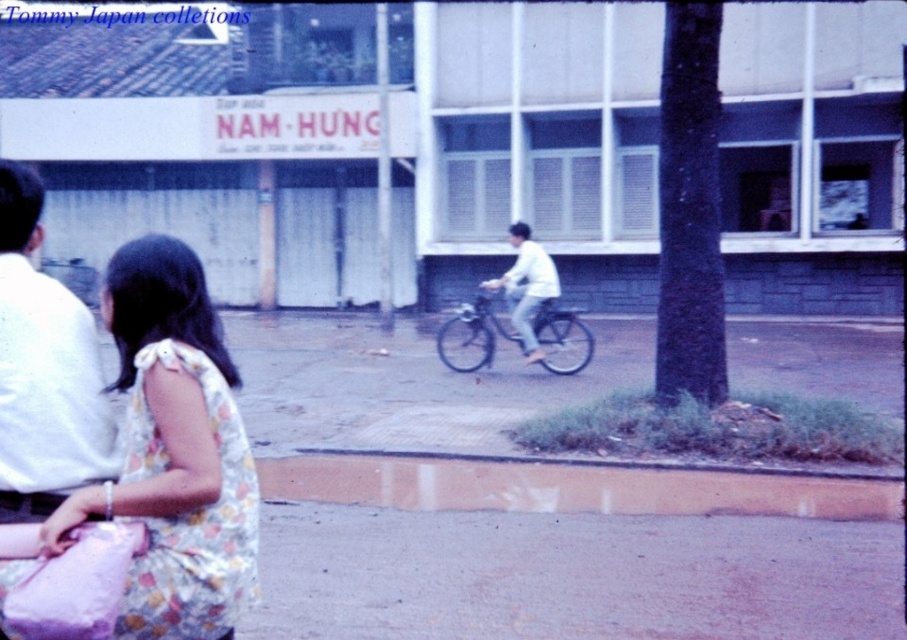
Who is higher up, floral fabric dress at lower left or white matte bicycle at center?

Positioned higher is white matte bicycle at center.

Can you confirm if floral fabric dress at lower left is positioned to the right of white matte bicycle at center?

No, floral fabric dress at lower left is not to the right of white matte bicycle at center.

Does point (201, 285) come in front of point (520, 332)?

Yes, it is.

The image size is (907, 640). I want to click on floral fabric dress at lower left, so click(174, 451).

Does point (155, 486) come in front of point (459, 369)?

Yes, point (155, 486) is in front of point (459, 369).

Does floral fabric dress at lower left appear under metallic silver bicycle at center?

Correct, floral fabric dress at lower left is located below metallic silver bicycle at center.

Between point (122, 300) and point (579, 321), which one is positioned behind?

Point (579, 321)

Where is `floral fabric dress at lower left`? This screenshot has width=907, height=640. floral fabric dress at lower left is located at coordinates (174, 451).

Does floral fabric dress at lower left come in front of white cotton shirt at left?

That is True.

Based on the photo, between floral fabric dress at lower left and white cotton shirt at left, which one appears on the right side from the viewer's perspective?

From the viewer's perspective, floral fabric dress at lower left appears more on the right side.

Is point (211, 490) positioned in front of point (54, 362)?

That is True.

What are the coordinates of `floral fabric dress at lower left` in the screenshot? It's located at (174, 451).